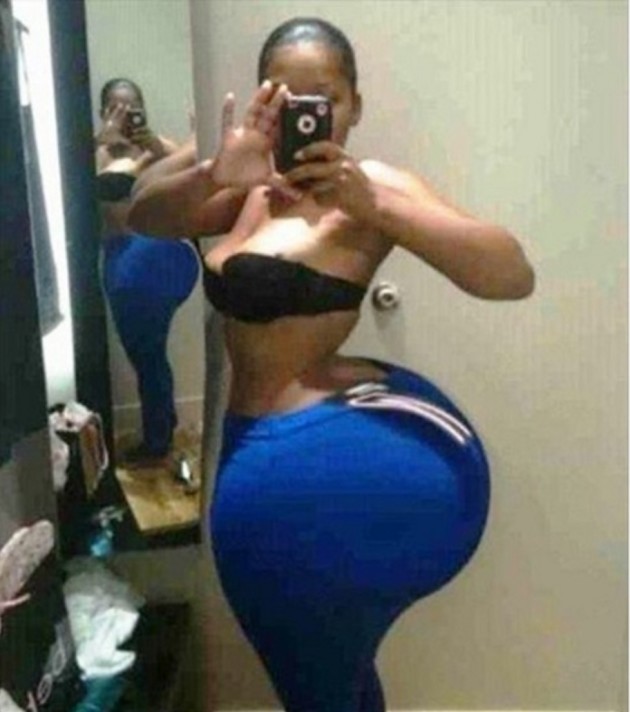
Identify the location of wall. Image resolution: width=630 pixels, height=712 pixels. (573, 253).